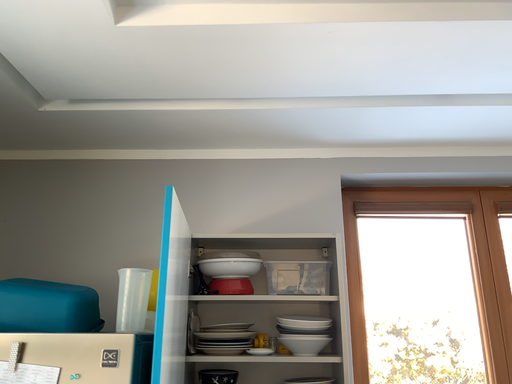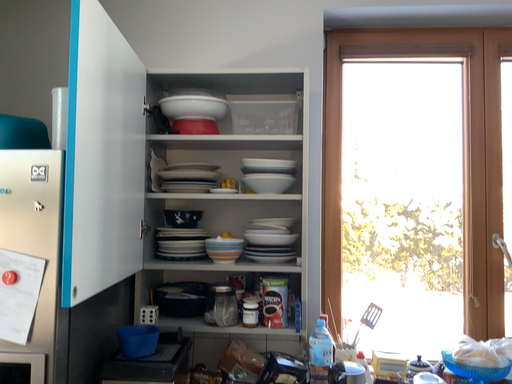
Question: Which way did the camera rotate in the video?

Choices:
 (A) rotated upward
 (B) rotated downward

Answer: (B)